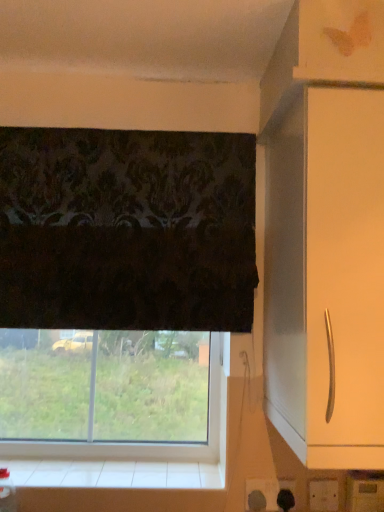
Question: From a real-world perspective, is white tile at lower center above or below transparent glass window at lower center?

Choices:
 (A) below
 (B) above

Answer: (A)

Question: Would you say white tile at lower center is inside or outside transparent glass window at lower center?

Choices:
 (A) outside
 (B) inside

Answer: (A)

Question: Based on their relative distances, which object is farther from the white tile at lower center?

Choices:
 (A) transparent glass window at lower center
 (B) white glossy cabinet handle at right

Answer: (B)

Question: Considering the real-world distances, which object is farthest from the white glossy cabinet handle at right?

Choices:
 (A) white tile at lower center
 (B) transparent glass window at lower center

Answer: (A)